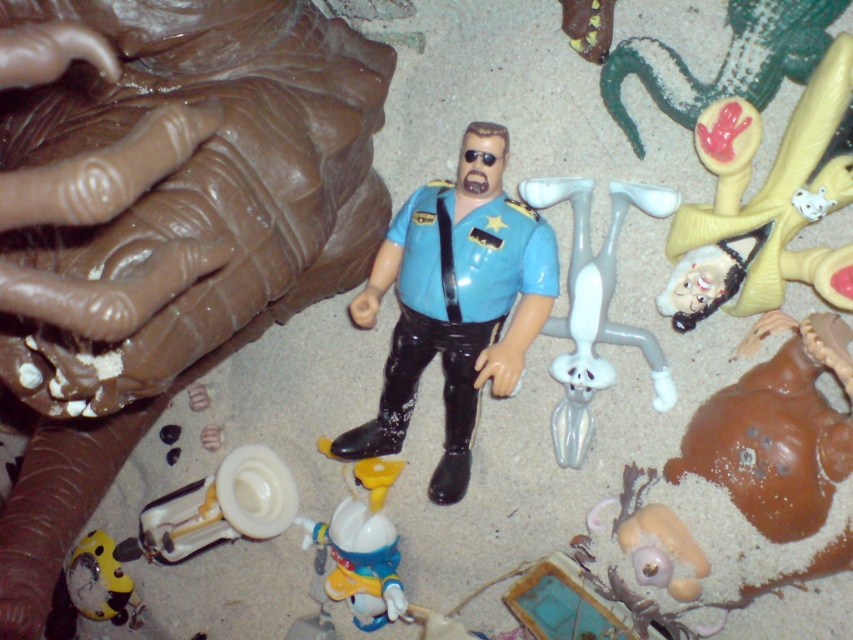
You are a small toy car starting at the point labeled as point (x=310, y=540). You want to reach the point labeled as point (x=463, y=390). Can you drive directly forward without turning to reach your destination?

Point (x=463, y=390) is in front of point (x=310, y=540), so yes, you can drive directly forward without turning to reach the destination.

You are looking at the image and want to know which of the two points, point (554,428) or point (114,564), is nearer to you. Can you tell me which one?

Point (554,428) is closer to the camera than point (114,564), so it is nearer to you.

You are a child trying to organize your toys. You have a shiny blue plastic toy at lower center and a yellow matte clock at lower left. Which toy is positioned higher up?

The shiny blue plastic toy at lower center is located above the yellow matte clock at lower left, so it is positioned higher up.